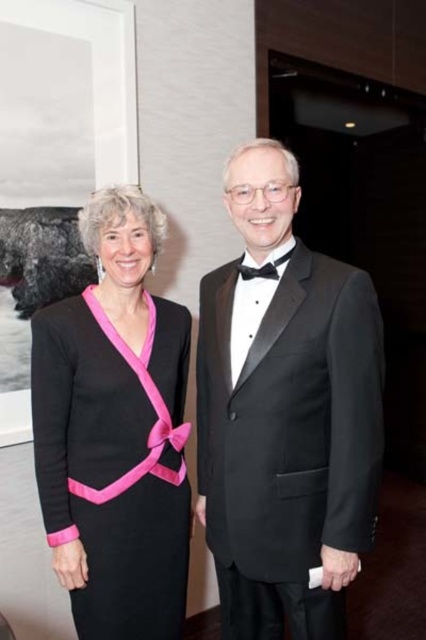
Question: Which of the following is the closest to the observer?

Choices:
 (A) (244, 266)
 (B) (83, 499)
 (C) (279, 291)
 (D) (43, 173)

Answer: (C)

Question: Which object is farther from the camera taking this photo?

Choices:
 (A) black satin tuxedo at center
 (B) black satin bow tie at center

Answer: (B)

Question: Can you confirm if matte black dress at left is thinner than black satin bow tie at center?

Choices:
 (A) no
 (B) yes

Answer: (A)

Question: In this image, where is matte black dress at left located relative to pink satin ribbon at center?

Choices:
 (A) below
 (B) above

Answer: (A)

Question: Which point is farther from the camera taking this photo?

Choices:
 (A) (83, 497)
 (B) (229, 285)
 (C) (271, 268)

Answer: (B)

Question: Where is black satin tuxedo at center located in relation to matte black dress at left in the image?

Choices:
 (A) below
 (B) above

Answer: (B)